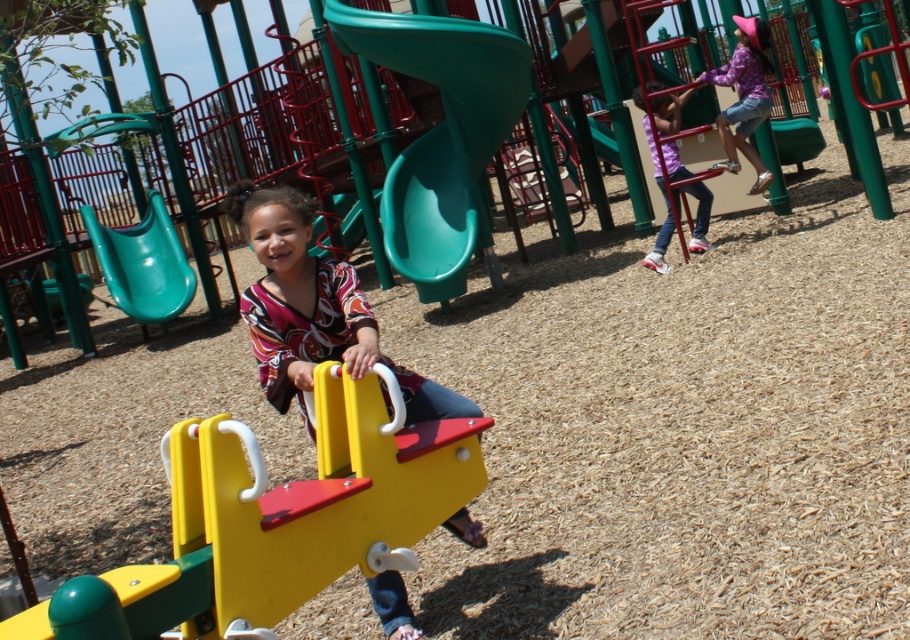
Between matte yellow seesaw at center and purple fabric shirt at upper right, which one is positioned higher?

purple fabric shirt at upper right

Between point (418, 384) and point (676, 205), which one is positioned in front?

Positioned in front is point (418, 384).

Between point (398, 605) and point (668, 198), which one is positioned in front?

Point (398, 605) is in front.

At what (x,y) coordinates should I click in order to perform the action: click on matte yellow seesaw at center. Please return your answer as a coordinate pair (x, y). The height and width of the screenshot is (640, 910). Looking at the image, I should click on (314, 308).

Is point (249, 566) behind point (684, 189)?

No, (249, 566) is closer to viewer.

Who is more distant from viewer, (332, 509) or (663, 124)?

Point (663, 124)

Find the location of a particular element. yellow plastic seesaw at center is located at coordinates (276, 518).

Who is more distant from viewer, (155, 204) or (666, 236)?

The point (155, 204) is behind.

Is green plastic slide at left taller than purple fabric shirt at upper right?

In fact, green plastic slide at left may be shorter than purple fabric shirt at upper right.

Find the location of a particular element. green plastic slide at left is located at coordinates (143, 262).